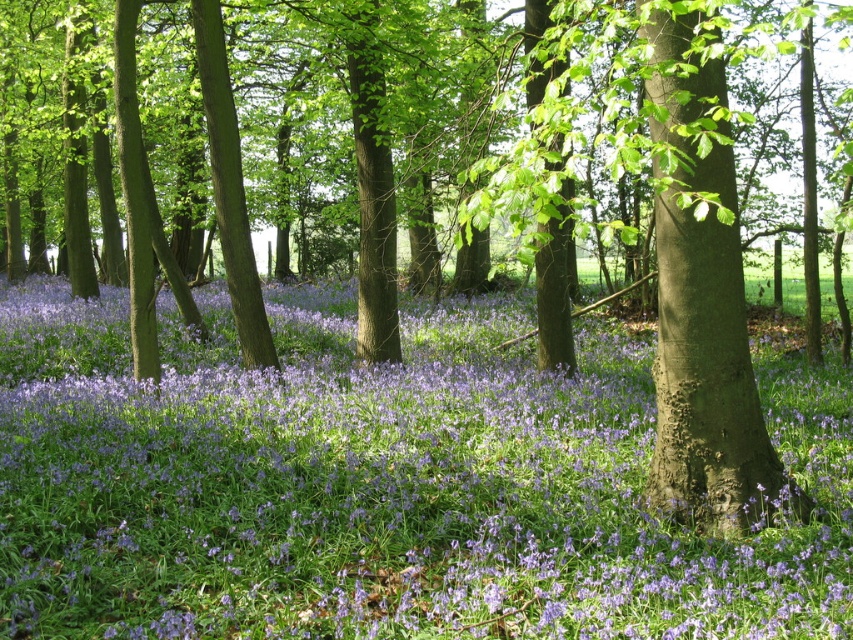
Is purple matte flower at center to the right of smooth brown tree trunk at center from the viewer's perspective?

In fact, purple matte flower at center is to the left of smooth brown tree trunk at center.

Does purple matte flower at center come in front of smooth brown tree trunk at center?

No, purple matte flower at center is behind smooth brown tree trunk at center.

Is point (842, 387) farther from camera compared to point (724, 266)?

That is True.

The width and height of the screenshot is (853, 640). In order to click on purple matte flower at center in this screenshot , I will do `click(381, 484)`.